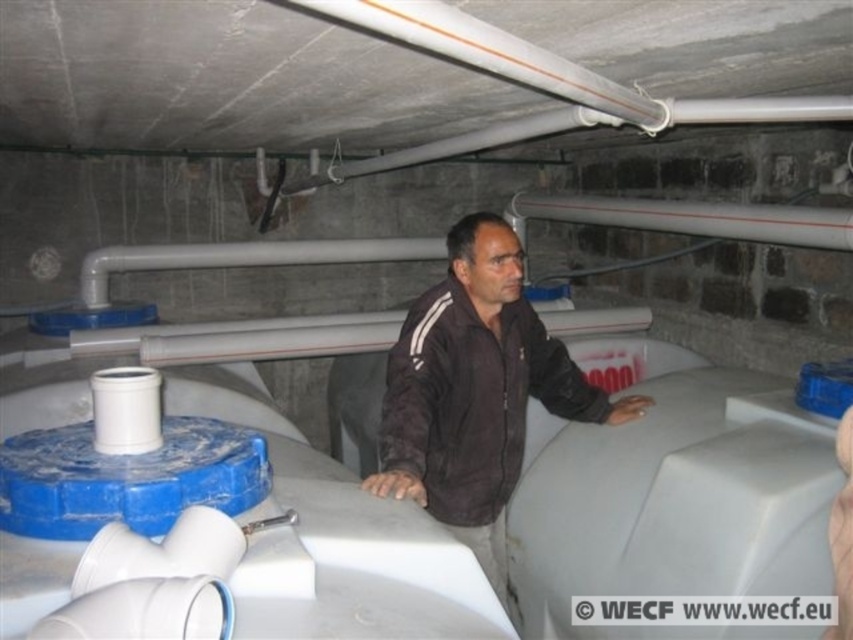
Measure the distance from dark brown fabric jacket at center to white glossy pipe at upper center.

They are 1.34 meters apart.

Is point (461, 435) closer to viewer compared to point (524, 208)?

Yes, point (461, 435) is in front of point (524, 208).

Locate an element on the screen. The image size is (853, 640). dark brown fabric jacket at center is located at coordinates (476, 392).